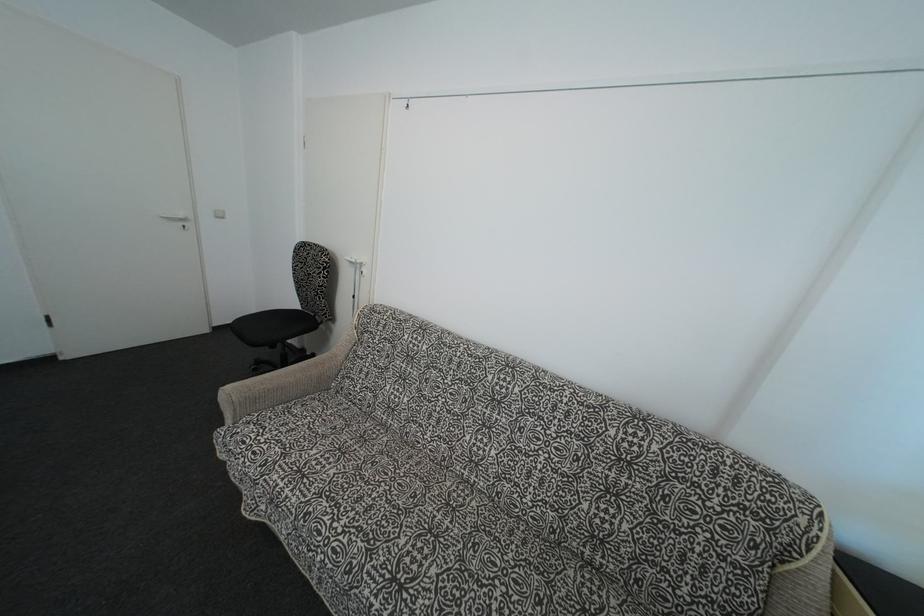
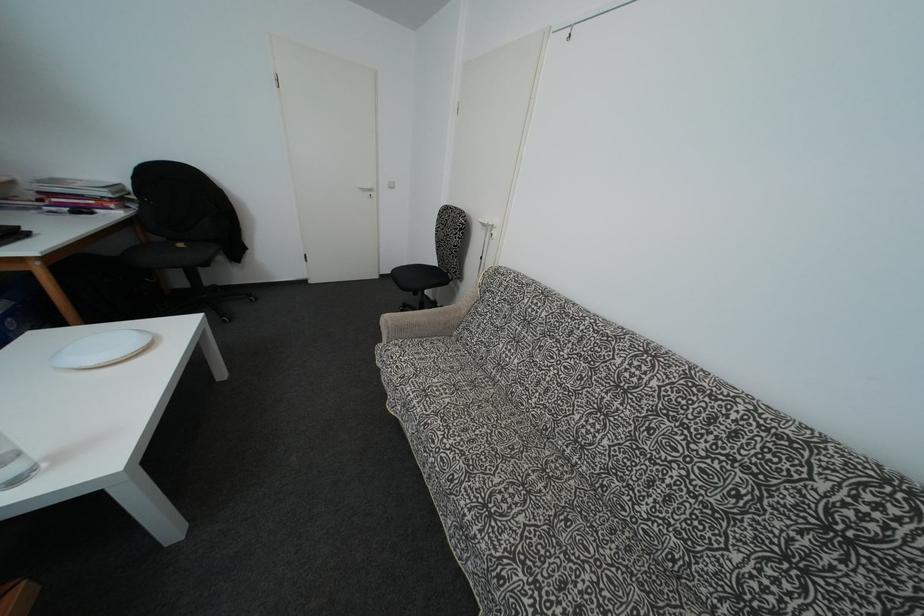
Question: Based on the continuous images, in which direction is the camera rotating? Reply with the corresponding letter.

Choices:
 (A) Left
 (B) Right
 (C) Up
 (D) Down

Answer: (A)